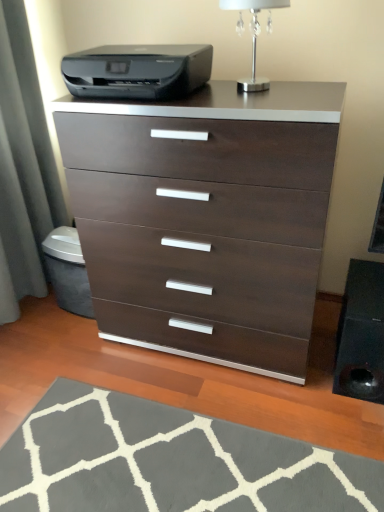
Question: Is black plastic printer at upper center positioned beyond the bounds of silver metallic table lamp at upper center?

Choices:
 (A) no
 (B) yes

Answer: (B)

Question: Considering the relative sizes of black plastic printer at upper center and silver metallic table lamp at upper center in the image provided, is black plastic printer at upper center bigger than silver metallic table lamp at upper center?

Choices:
 (A) no
 (B) yes

Answer: (B)

Question: Can you confirm if black plastic printer at upper center is shorter than silver metallic table lamp at upper center?

Choices:
 (A) no
 (B) yes

Answer: (B)

Question: Can you confirm if black plastic printer at upper center is thinner than silver metallic table lamp at upper center?

Choices:
 (A) no
 (B) yes

Answer: (A)

Question: Does black plastic printer at upper center lie in front of silver metallic table lamp at upper center?

Choices:
 (A) yes
 (B) no

Answer: (B)

Question: Looking at the image, does dark wood/finish chest of drawers at center seem bigger or smaller compared to silver metallic table lamp at upper center?

Choices:
 (A) big
 (B) small

Answer: (A)

Question: From the image's perspective, relative to silver metallic table lamp at upper center, is dark wood/finish chest of drawers at center above or below?

Choices:
 (A) below
 (B) above

Answer: (A)

Question: Is point (317, 263) closer or farther from the camera than point (238, 23)?

Choices:
 (A) farther
 (B) closer

Answer: (B)

Question: Choose the correct answer: Is dark wood/finish chest of drawers at center inside silver metallic table lamp at upper center or outside it?

Choices:
 (A) inside
 (B) outside

Answer: (B)

Question: Looking at the image, does silver metallic table lamp at upper center seem bigger or smaller compared to dark wood/finish chest of drawers at center?

Choices:
 (A) small
 (B) big

Answer: (A)

Question: Is silver metallic table lamp at upper center in front of or behind dark wood/finish chest of drawers at center in the image?

Choices:
 (A) behind
 (B) front

Answer: (A)

Question: From the image's perspective, is silver metallic table lamp at upper center located above or below dark wood/finish chest of drawers at center?

Choices:
 (A) above
 (B) below

Answer: (A)

Question: Would you say silver metallic table lamp at upper center is inside or outside dark wood/finish chest of drawers at center?

Choices:
 (A) outside
 (B) inside

Answer: (A)

Question: Is silver metallic table lamp at upper center situated inside black plastic printer at upper center or outside?

Choices:
 (A) inside
 (B) outside

Answer: (B)

Question: Considering their positions, is silver metallic table lamp at upper center located in front of or behind black plastic printer at upper center?

Choices:
 (A) front
 (B) behind

Answer: (A)